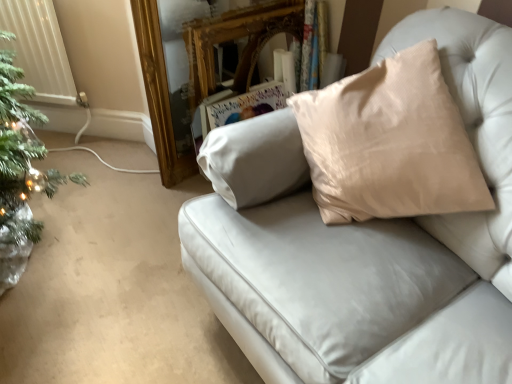
The image size is (512, 384). What are the coordinates of `white plastic radiator at left` in the screenshot? It's located at (39, 49).

Describe the element at coordinates (362, 243) in the screenshot. Image resolution: width=512 pixels, height=384 pixels. I see `satin beige pillow at upper right` at that location.

What do you see at coordinates (234, 39) in the screenshot? I see `gold ornate mirror at upper center` at bounding box center [234, 39].

Locate an element on the screen. white plastic radiator at left is located at coordinates (39, 49).

Between white plastic radiator at left and satin beige pillow at upper right, which one appears on the right side from the viewer's perspective?

Positioned to the right is satin beige pillow at upper right.

Between white plastic radiator at left and satin beige pillow at upper right, which one has smaller size?

white plastic radiator at left.

Considering the sizes of objects white plastic radiator at left and satin beige pillow at upper right in the image provided, who is shorter, white plastic radiator at left or satin beige pillow at upper right?

white plastic radiator at left.

Consider the image. Can you see white plastic radiator at left touching satin beige pillow at upper right?

No, white plastic radiator at left is not next to satin beige pillow at upper right.

Between point (21, 9) and point (255, 48), which one is positioned in front?

Point (21, 9)

Considering the sizes of objects white plastic radiator at left and gold ornate mirror at upper center in the image provided, who is bigger, white plastic radiator at left or gold ornate mirror at upper center?

Bigger between the two is gold ornate mirror at upper center.

Is white plastic radiator at left shorter than gold ornate mirror at upper center?

Yes.

Is white plastic radiator at left closer to camera compared to gold ornate mirror at upper center?

No, white plastic radiator at left is behind gold ornate mirror at upper center.

Find the location of a particular element. The image size is (512, 384). mirror that is above the satin beige pillow at upper right (from the image's perspective) is located at coordinates (234, 39).

From the image's perspective, is gold ornate mirror at upper center on satin beige pillow at upper right?

Yes.

Is gold ornate mirror at upper center directly adjacent to satin beige pillow at upper right?

No, gold ornate mirror at upper center is not making contact with satin beige pillow at upper right.

Considering the sizes of gold ornate mirror at upper center and satin beige pillow at upper right in the image, is gold ornate mirror at upper center bigger or smaller than satin beige pillow at upper right?

In the image, gold ornate mirror at upper center appears to be smaller than satin beige pillow at upper right.

Between gold ornate mirror at upper center and white plastic radiator at left, which one has more height?

gold ornate mirror at upper center is taller.

Based on the photo, measure the distance from gold ornate mirror at upper center to white plastic radiator at left.

gold ornate mirror at upper center is 27.09 inches from white plastic radiator at left.

Is gold ornate mirror at upper center turned away from white plastic radiator at left?

That's not correct — gold ornate mirror at upper center is not looking away from white plastic radiator at left.

At what (x,y) coordinates should I click in order to perform the action: click on mirror lying on the right of white plastic radiator at left. Please return your answer as a coordinate pair (x, y). Looking at the image, I should click on (234, 39).

In terms of size, does satin beige pillow at upper right appear bigger or smaller than gold ornate mirror at upper center?

Clearly, satin beige pillow at upper right is larger in size than gold ornate mirror at upper center.

Based on the photo, who is more distant, satin beige pillow at upper right or gold ornate mirror at upper center?

Positioned behind is gold ornate mirror at upper center.

Does satin beige pillow at upper right have a greater height compared to gold ornate mirror at upper center?

Yes, satin beige pillow at upper right is taller than gold ornate mirror at upper center.

From a real-world perspective, which object rests below the other?

gold ornate mirror at upper center is physically lower.

Is satin beige pillow at upper right oriented towards white plastic radiator at left?

No.

From a real-world perspective, between satin beige pillow at upper right and white plastic radiator at left, who is vertically lower?

white plastic radiator at left is physically lower.

Does point (463, 300) come in front of point (37, 46)?

Yes, point (463, 300) is in front of point (37, 46).

From the image's perspective, which one is positioned higher, satin beige pillow at upper right or white plastic radiator at left?

white plastic radiator at left is shown above in the image.

Where is `studio couch below the white plastic radiator at left (from the image's perspective)`? studio couch below the white plastic radiator at left (from the image's perspective) is located at coordinates (362, 243).

Where is `radiator that is behind the gold ornate mirror at upper center`? The height and width of the screenshot is (384, 512). radiator that is behind the gold ornate mirror at upper center is located at coordinates (39, 49).

Estimate the real-world distances between objects in this image. Which object is closer to gold ornate mirror at upper center, white plastic radiator at left or satin beige pillow at upper right?

Based on the image, white plastic radiator at left appears to be nearer to gold ornate mirror at upper center.

From the image, which object appears to be farther from satin beige pillow at upper right, gold ornate mirror at upper center or white plastic radiator at left?

white plastic radiator at left is further to satin beige pillow at upper right.

Considering their positions, is satin beige pillow at upper right positioned closer to white plastic radiator at left than gold ornate mirror at upper center?

gold ornate mirror at upper center lies closer to white plastic radiator at left than the other object.

Considering their positions, is white plastic radiator at left positioned closer to satin beige pillow at upper right than gold ornate mirror at upper center?

gold ornate mirror at upper center is closer to satin beige pillow at upper right.

Considering their positions, is satin beige pillow at upper right positioned further to gold ornate mirror at upper center than white plastic radiator at left?

satin beige pillow at upper right is further to gold ornate mirror at upper center.

When comparing their distances from white plastic radiator at left, does gold ornate mirror at upper center or satin beige pillow at upper right seem closer?

Among the two, gold ornate mirror at upper center is located nearer to white plastic radiator at left.

Find the location of `mirror located between white plastic radiator at left and satin beige pillow at upper right in the left-right direction`. mirror located between white plastic radiator at left and satin beige pillow at upper right in the left-right direction is located at coordinates (234, 39).